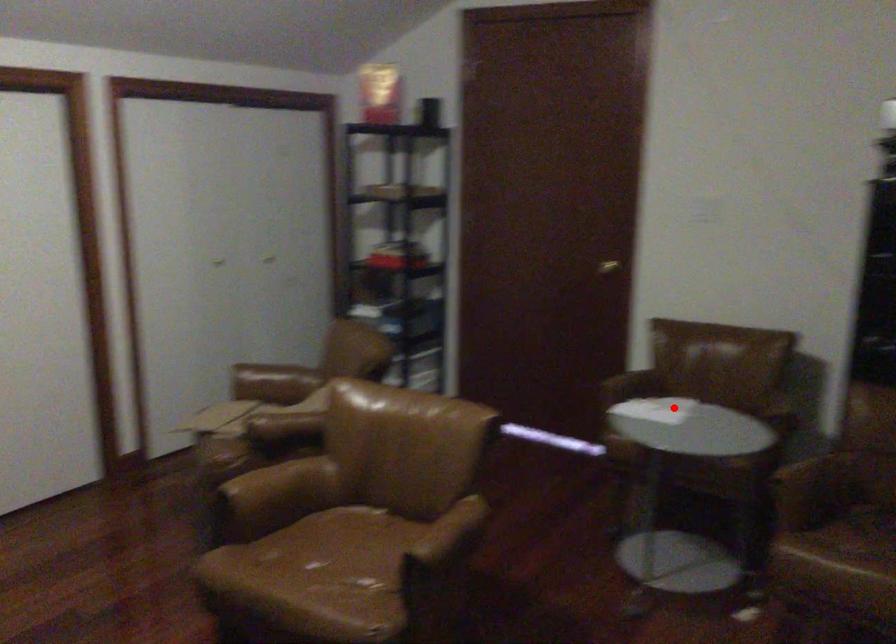
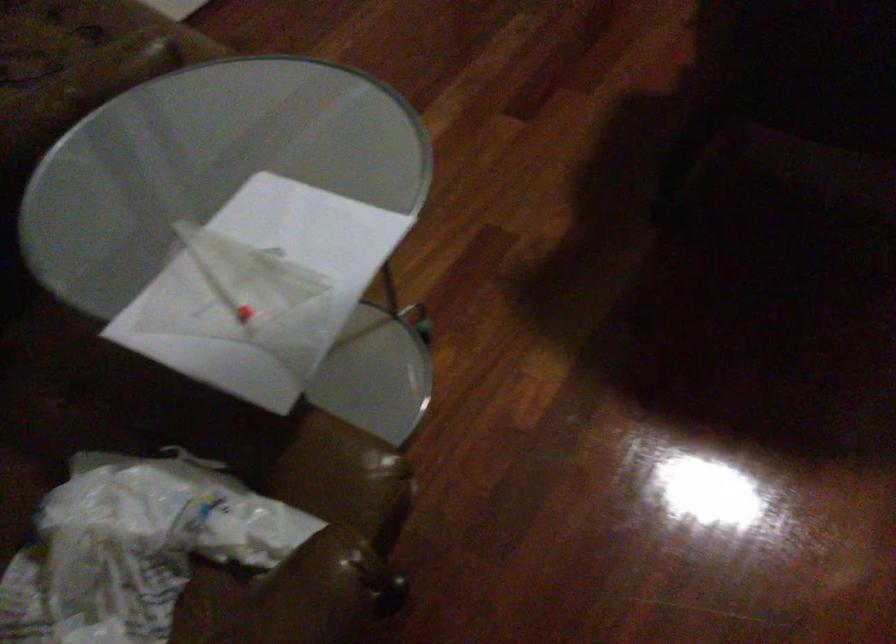
Question: I am providing you with two images of the same scene from different viewpoints. A red point is shown in image1. For the corresponding object point in image2, is it positioned nearer or farther from the camera?

Choices:
 (A) Nearer
 (B) Farther

Answer: (A)